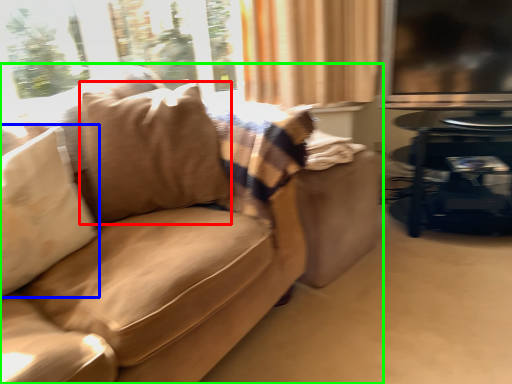
Question: Considering the real-world distances, which object is farthest from throw pillow (highlighted by a red box)? pillow (highlighted by a blue box) or studio couch (highlighted by a green box)?

Choices:
 (A) pillow
 (B) studio couch

Answer: (A)